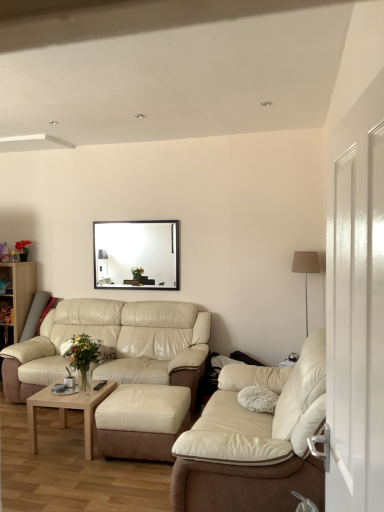
Find the location of a particular element. The height and width of the screenshot is (512, 384). blank space situated above black glossy picture frame at upper center (from a real-world perspective) is located at coordinates (146, 217).